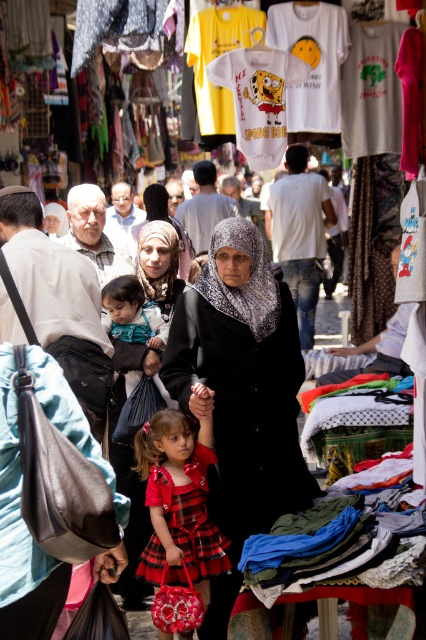
Question: Is black matte coat at center behind matte black hijab at center?

Choices:
 (A) yes
 (B) no

Answer: (B)

Question: Estimate the real-world distances between objects in this image. Which object is farther from the black matte coat at center?

Choices:
 (A) plaid fabric dress at center
 (B) teal satin dress at center
 (C) matte gray hijab at center

Answer: (C)

Question: Which of the following is the farthest from the observer?

Choices:
 (A) (147, 544)
 (B) (161, 188)
 (C) (118, 332)
 (D) (150, 369)

Answer: (B)

Question: Does teal satin dress at center have a lesser width compared to matte gray hijab at center?

Choices:
 (A) yes
 (B) no

Answer: (B)

Question: Is black matte coat at center to the right of matte gray hijab at center from the viewer's perspective?

Choices:
 (A) yes
 (B) no

Answer: (A)

Question: Among these points, which one is nearest to the camera?

Choices:
 (A) (301, 298)
 (B) (166, 211)
 (C) (199, 228)

Answer: (B)